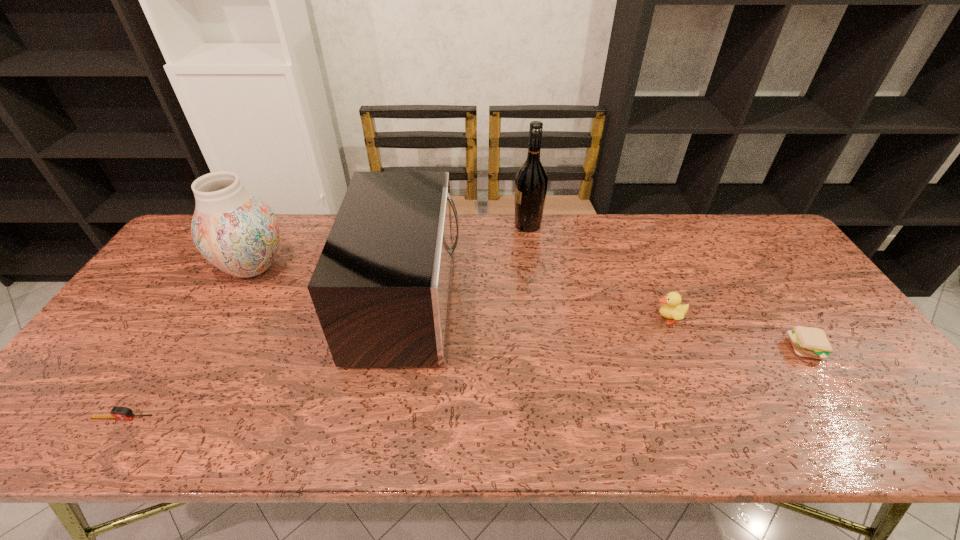
Find the location of a particular element. vacant position in the image that satisfies the following two spatial constraints: 1. on the label of the wine bottle; 2. on the back side of the patty is located at coordinates (544, 349).